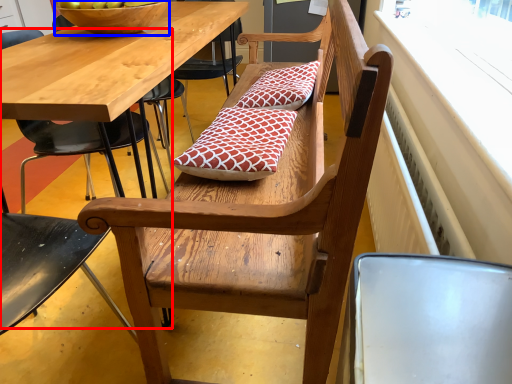
Question: Which of the following is the farthest to the observer, chair (highlighted by a red box) or bowl (highlighted by a blue box)?

Choices:
 (A) chair
 (B) bowl

Answer: (B)